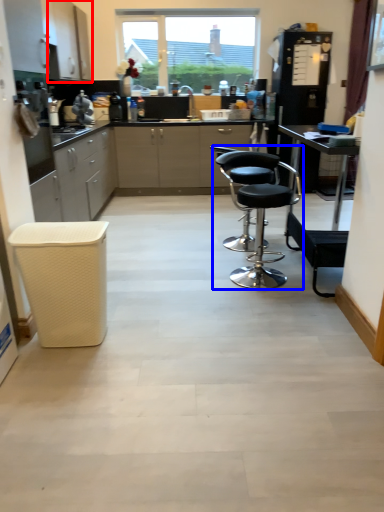
Question: Which of the following is the closest to the observer, cabinetry (highlighted by a red box) or chair (highlighted by a blue box)?

Choices:
 (A) cabinetry
 (B) chair

Answer: (B)